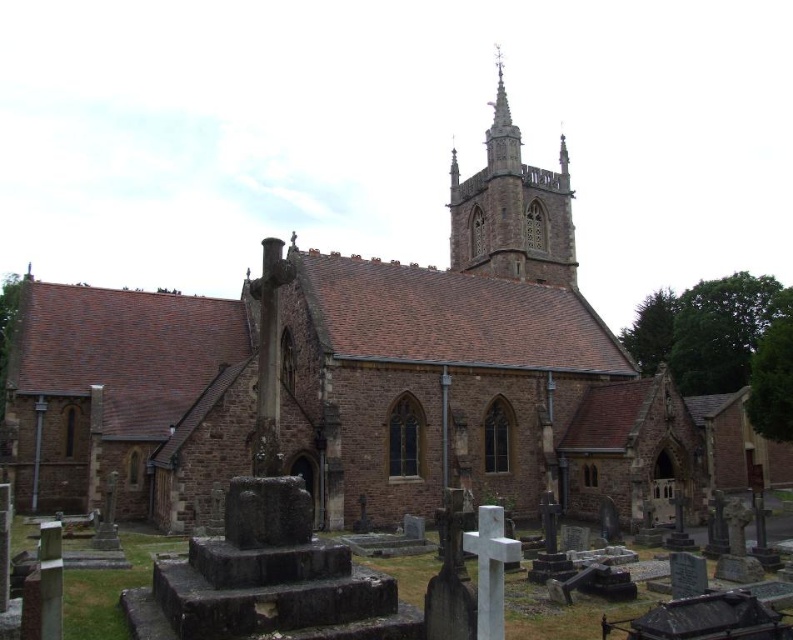
You are a maintenance worker needing to reach the smooth stone tower at upper center from the rusty stone tombstone at lower center. Given that your equipment can only handle a maximum distance of 80 meters, will you be able to safely transport your tools to the tower?

The distance between the rusty stone tombstone at lower center and the smooth stone tower at upper center is 85.27 meters, which exceeds the equipment limit of 80 meters. Therefore, it is not safe to transport the tools over this distance.

You are standing at the entrance of the church and want to find the rusty stone tombstone at lower center. According to the coordinates provided, in which direction should you walk from the entrance to reach it?

The rusty stone tombstone at lower center is located at coordinates 0.911 on the x axis and 0.378 on the y axis. Since the entrance is at the center, you should walk towards the lower right direction to reach it.